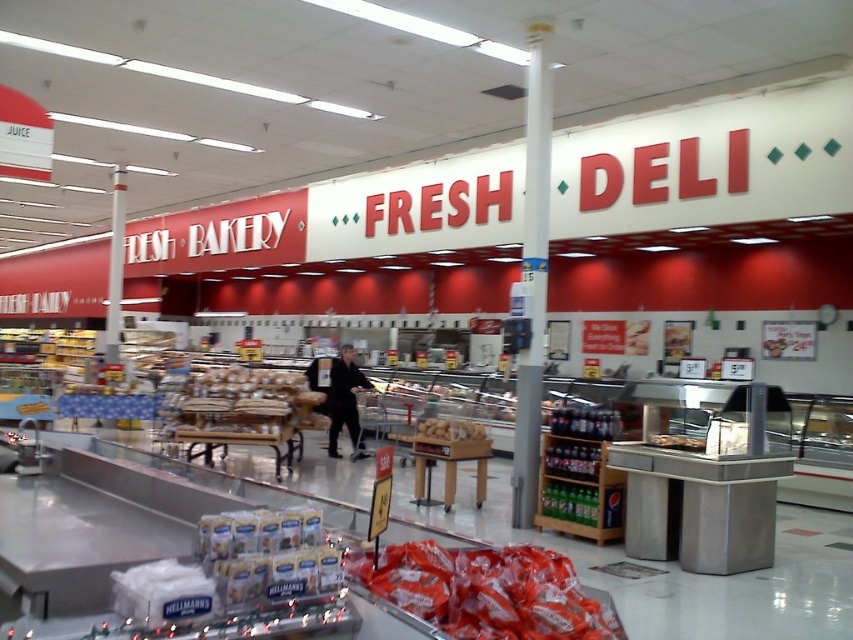
Can you confirm if bread matte at center is shorter than smooth brown bread at center?

Incorrect, bread matte at center's height does not fall short of smooth brown bread at center's.

Locate an element on the screen. bread matte at center is located at coordinates (247, 397).

Find the location of `bread matte at center`. bread matte at center is located at coordinates click(247, 397).

Is matte plastic bags of chips at center positioned before bread matte at center?

Yes.

Between point (352, 573) and point (194, 385), which one is positioned in front?

Point (352, 573) is in front.

Where is `matte plastic bags of chips at center`? Image resolution: width=853 pixels, height=640 pixels. matte plastic bags of chips at center is located at coordinates (485, 589).

Where is `matte plastic bags of chips at center`? This screenshot has height=640, width=853. matte plastic bags of chips at center is located at coordinates (485, 589).

Is smooth brown bread at center above translucent plastic bag at center?

Actually, smooth brown bread at center is below translucent plastic bag at center.

Is smooth brown bread at center shorter than translucent plastic bag at center?

No, smooth brown bread at center is not shorter than translucent plastic bag at center.

You are a GUI agent. You are given a task and a screenshot of the screen. Output one action in this format:
    pyautogui.click(x=<x>, y=<y>)
    Task: Click on the smooth brown bread at center
    This screenshot has height=640, width=853.
    Given the screenshot: What is the action you would take?
    pyautogui.click(x=451, y=429)